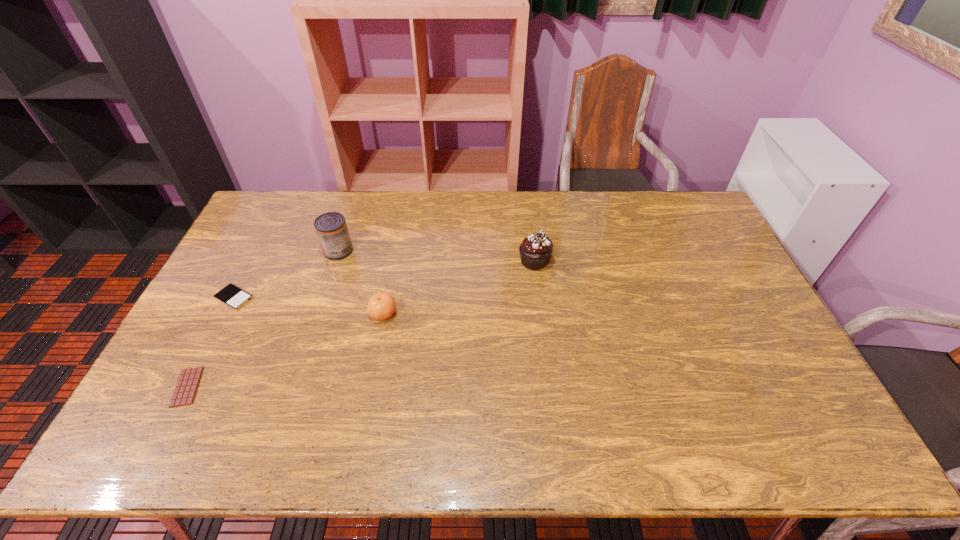
This screenshot has height=540, width=960. Find the location of `the third object from right to left`. the third object from right to left is located at coordinates (331, 228).

At what (x,y) coordinates should I click in order to perform the action: click on cupcake. Please return your answer as a coordinate pair (x, y). Looking at the image, I should click on (535, 250).

The height and width of the screenshot is (540, 960). In order to click on clementine in this screenshot , I will do `click(381, 306)`.

Where is `the third tallest object`? The width and height of the screenshot is (960, 540). the third tallest object is located at coordinates (381, 306).

The width and height of the screenshot is (960, 540). I want to click on iPod, so click(x=234, y=297).

Find the location of `candy bar`. candy bar is located at coordinates (186, 387).

This screenshot has height=540, width=960. In order to click on the shortest object in this screenshot , I will do `click(186, 387)`.

What are the coordinates of `blank space located 0.090m on the front of the can` in the screenshot? It's located at (328, 280).

The height and width of the screenshot is (540, 960). I want to click on free location located on the back of the cupcake, so click(x=526, y=196).

Find the location of a particular element. The image size is (960, 540). vacant space located on the right of the third tallest object is located at coordinates (424, 313).